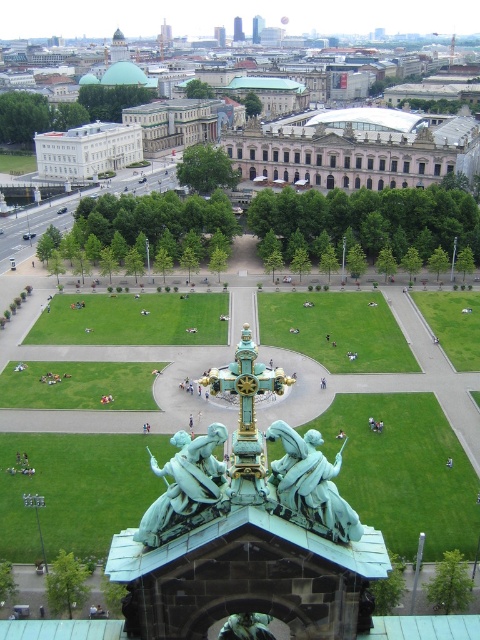
Question: Is green patina statue at center closer to camera compared to green patinated bronze statue at center?

Choices:
 (A) no
 (B) yes

Answer: (B)

Question: Which point appears farthest from the camera in this image?

Choices:
 (A) (74, 172)
 (B) (191, 440)
 (C) (302, 500)
 (D) (240, 612)

Answer: (A)

Question: Among these objects, which one is farthest from the camera?

Choices:
 (A) green patinated bronze statue at center
 (B) bronze/golden statue at center
 (C) white marble palace at left

Answer: (C)

Question: Considering the relative positions of white marble palace at left and green patinated bronze statue at center in the image provided, where is white marble palace at left located with respect to green patinated bronze statue at center?

Choices:
 (A) right
 (B) left

Answer: (B)

Question: Estimate the real-world distances between objects in this image. Which object is farther from the green patina statue at center?

Choices:
 (A) green patinated bronze statue at center
 (B) white marble palace at left

Answer: (B)

Question: Can you confirm if green patina statue at center is positioned below white marble palace at left?

Choices:
 (A) yes
 (B) no

Answer: (A)